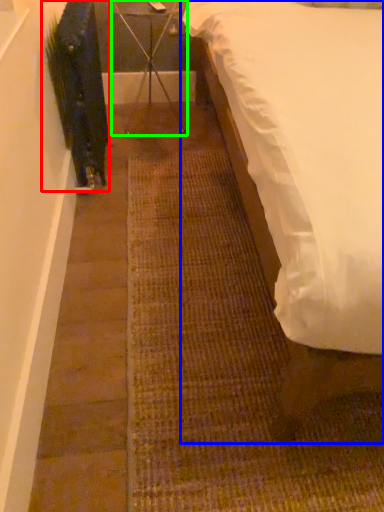
Question: Based on their relative distances, which object is nearer to plant (highlighted by a red box)? Choose from bed (highlighted by a blue box) and furniture (highlighted by a green box).

Choices:
 (A) bed
 (B) furniture

Answer: (B)